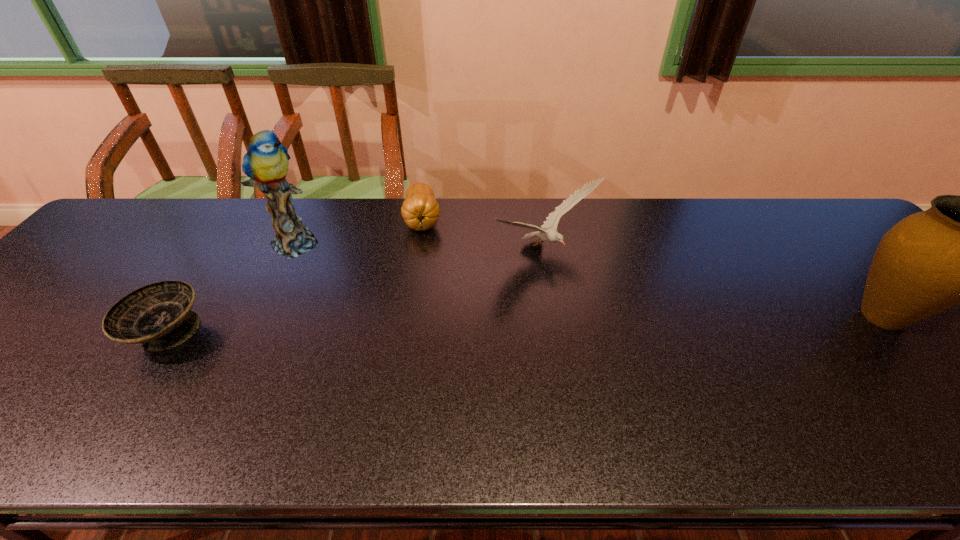
Identify the location of vacant region at the far right corner of the desktop. Image resolution: width=960 pixels, height=540 pixels. (793, 212).

Where is `free space between the second tallest object and the second shortest object`? This screenshot has height=540, width=960. free space between the second tallest object and the second shortest object is located at coordinates (653, 268).

Where is `empty space that is in between the gull and the second tallest object`? empty space that is in between the gull and the second tallest object is located at coordinates (714, 284).

Where is `vacant area between the third object from right to left and the rightmost object`? The height and width of the screenshot is (540, 960). vacant area between the third object from right to left and the rightmost object is located at coordinates (653, 268).

Image resolution: width=960 pixels, height=540 pixels. Identify the location of free area in between the shortest object and the urn. (524, 325).

Find the location of `free space between the gull and the tallest object`. free space between the gull and the tallest object is located at coordinates (421, 246).

Where is `free spot between the leftmost object and the gull`? free spot between the leftmost object and the gull is located at coordinates (356, 292).

This screenshot has height=540, width=960. I want to click on blank region between the bowl and the third tallest object, so click(356, 292).

This screenshot has width=960, height=540. Identify the location of vacant space that's between the bowl and the second tallest object. (524, 325).

Image resolution: width=960 pixels, height=540 pixels. In order to click on vacant space in between the second object from right to left and the tallest object in this screenshot , I will do `click(421, 246)`.